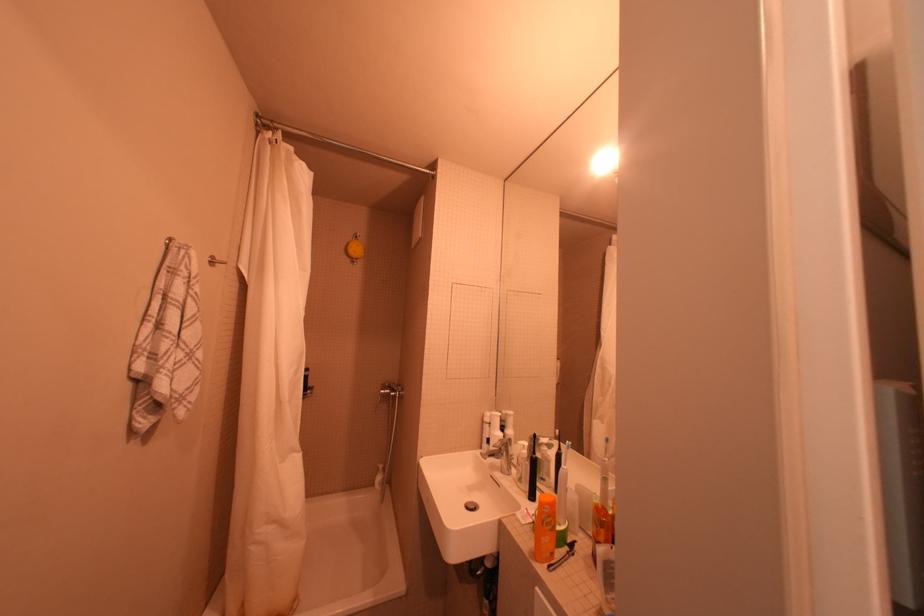
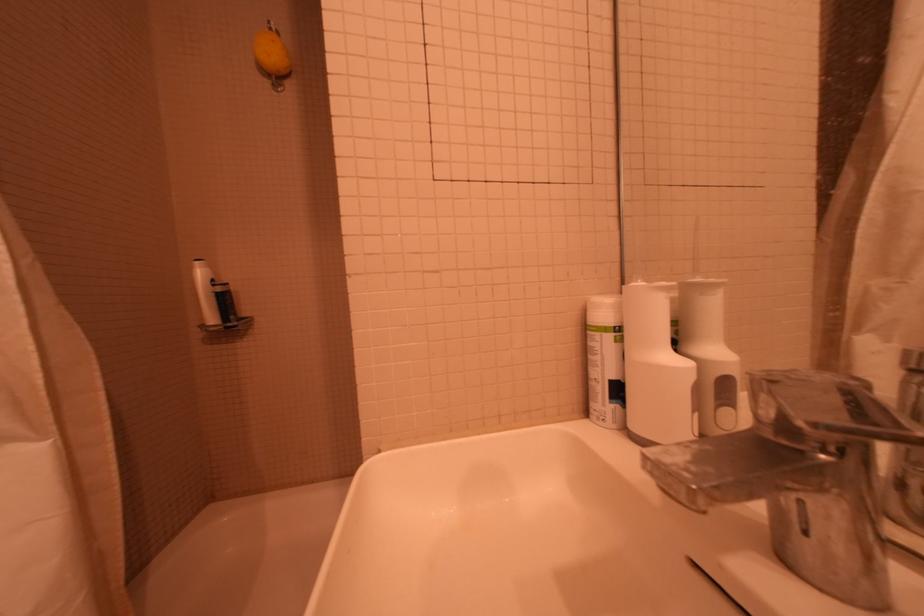
Question: In a continuous first-person perspective shot, in which direction is the camera moving?

Choices:
 (A) Left
 (B) Right
 (C) Forward
 (D) Backward

Answer: (C)